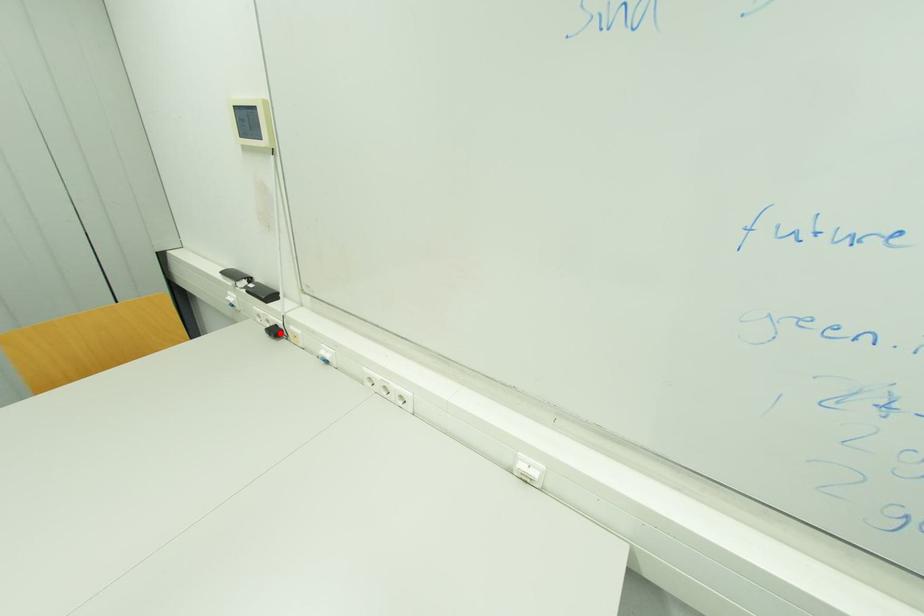
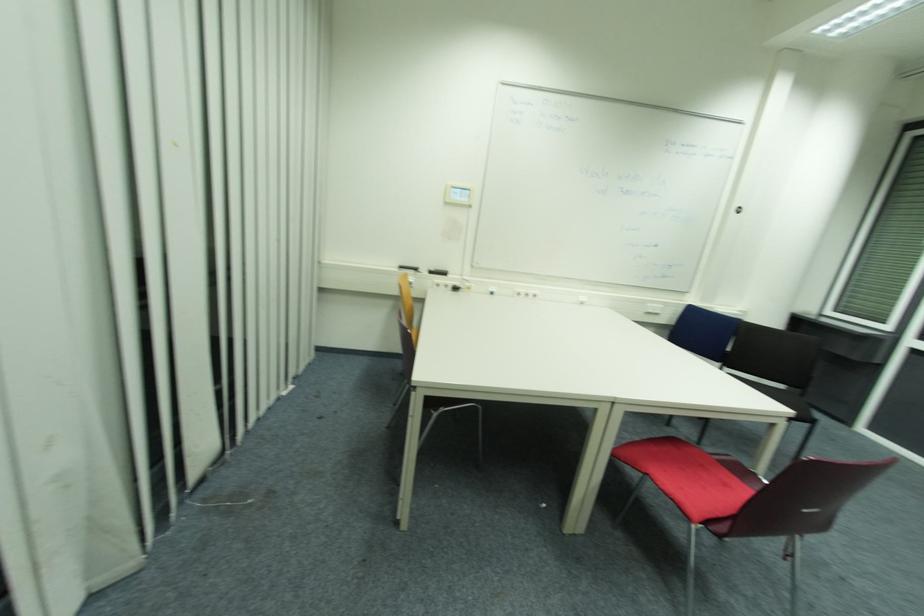
Find the pixel in the second image that matches the highlighted location in the first image.

(458, 290)